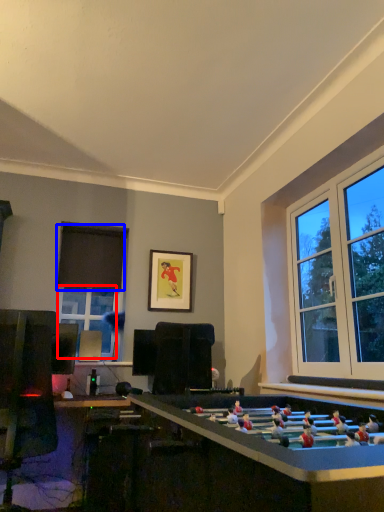
Question: Which object is further to the camera taking this photo, window (highlighted by a red box) or curtain (highlighted by a blue box)?

Choices:
 (A) window
 (B) curtain

Answer: (B)